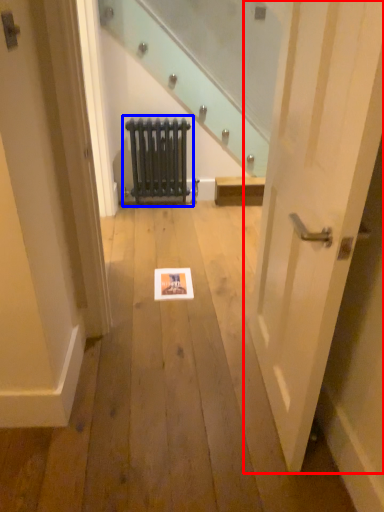
Question: Which object is further to the camera taking this photo, door (highlighted by a red box) or radiator (highlighted by a blue box)?

Choices:
 (A) door
 (B) radiator

Answer: (B)